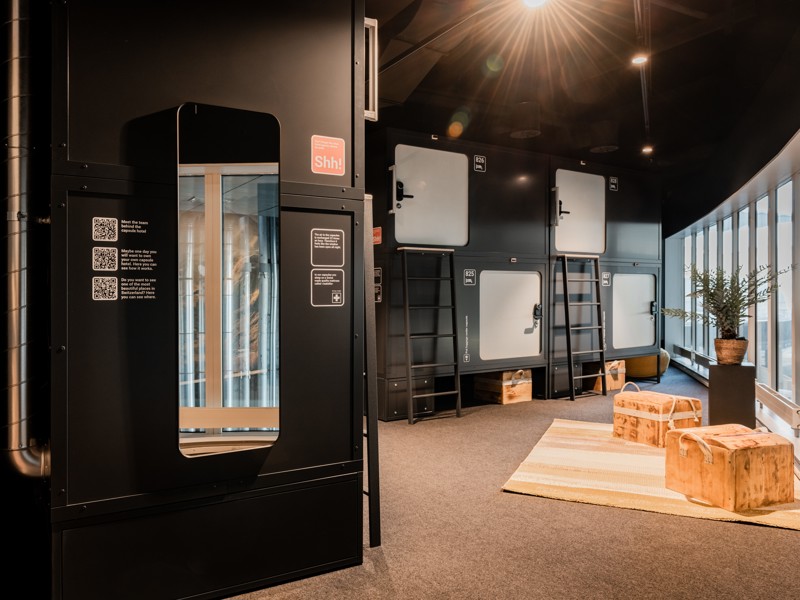
Locate an element on the screen. The image size is (800, 600). ladder is located at coordinates (374, 439), (413, 336), (569, 303).